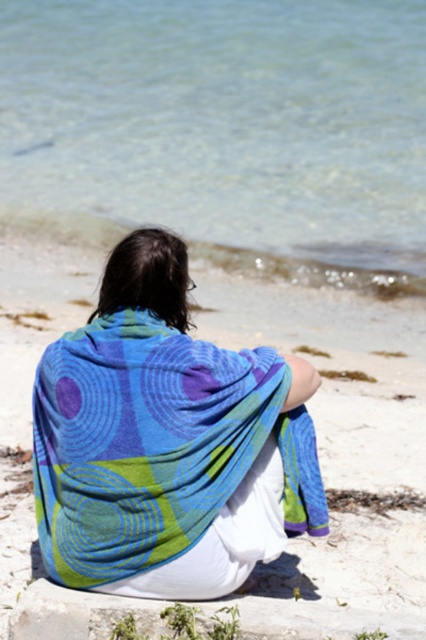
Question: Which point is closer to the camera taking this photo?

Choices:
 (A) (374, 234)
 (B) (123, 461)

Answer: (B)

Question: Which of the following is the farthest from the observer?

Choices:
 (A) textured cotton blanket at center
 (B) clear water at upper center

Answer: (B)

Question: From the image, what is the correct spatial relationship of clear water at upper center in relation to textured cotton blanket at center?

Choices:
 (A) left
 (B) right

Answer: (B)

Question: Is clear water at upper center to the left of textured cotton blanket at center from the viewer's perspective?

Choices:
 (A) no
 (B) yes

Answer: (A)

Question: Where is clear water at upper center located in relation to textured cotton blanket at center in the image?

Choices:
 (A) below
 (B) above

Answer: (B)